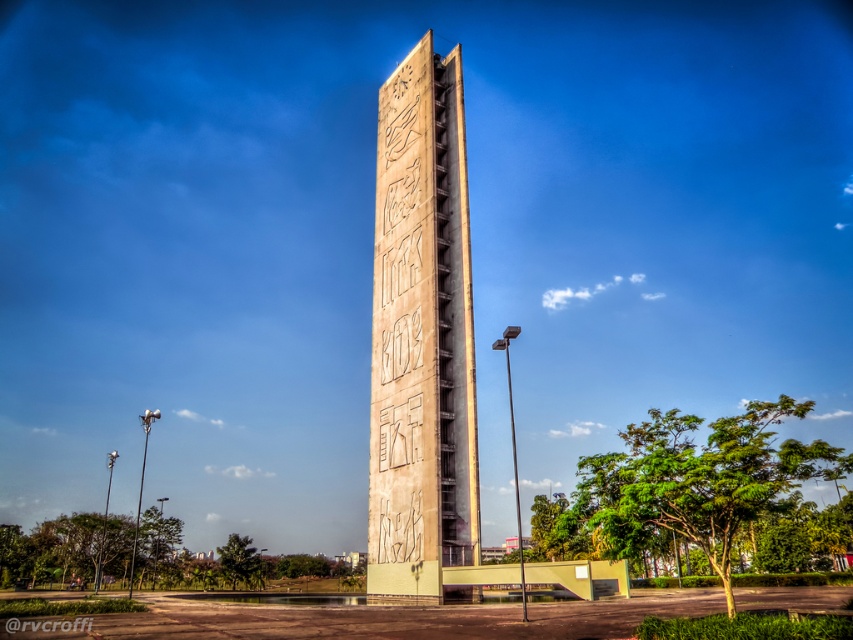
Question: From the image, what is the correct spatial relationship of beige concrete tower at center in relation to carved stone monument at center?

Choices:
 (A) right
 (B) left

Answer: (A)

Question: Does beige concrete tower at center lie behind carved stone monument at center?

Choices:
 (A) yes
 (B) no

Answer: (A)

Question: Which of the following is the farthest from the observer?

Choices:
 (A) (7, 625)
 (B) (395, 420)

Answer: (B)

Question: Is the position of beige concrete tower at center less distant than that of carved stone monument at center?

Choices:
 (A) no
 (B) yes

Answer: (A)